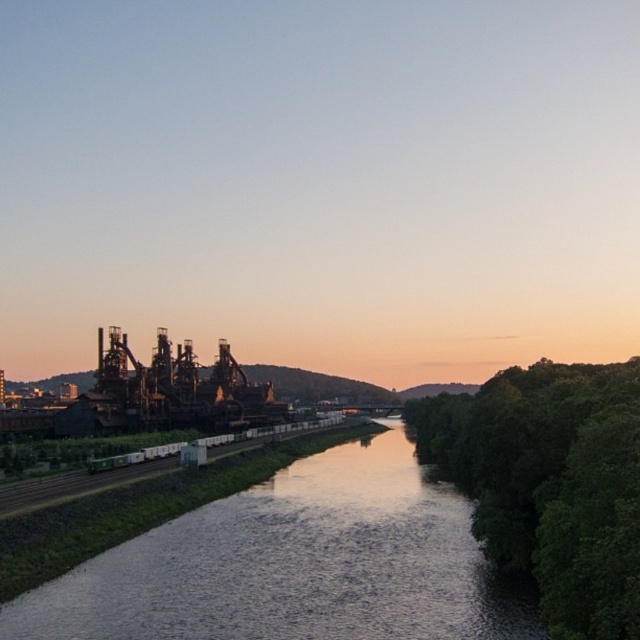
Question: Does dark reflective water at center have a greater width compared to green leafy trees at right?

Choices:
 (A) no
 (B) yes

Answer: (B)

Question: Which of the following is the farthest from the observer?

Choices:
 (A) (280, 509)
 (B) (636, 577)

Answer: (A)

Question: Is dark reflective water at center smaller than green leafy trees at right?

Choices:
 (A) yes
 (B) no

Answer: (A)

Question: Which object appears closest to the camera in this image?

Choices:
 (A) dark reflective water at center
 (B) green leafy trees at right

Answer: (B)

Question: Does dark reflective water at center have a lesser width compared to green leafy trees at right?

Choices:
 (A) no
 (B) yes

Answer: (A)

Question: Which point is closer to the camera?

Choices:
 (A) dark reflective water at center
 (B) green leafy trees at right

Answer: (B)